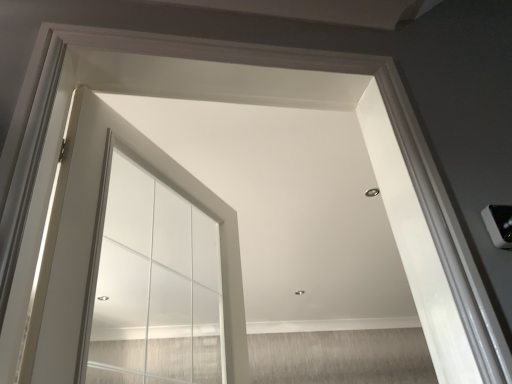
Image resolution: width=512 pixels, height=384 pixels. What do you see at coordinates (93, 224) in the screenshot?
I see `white glossy door at upper left` at bounding box center [93, 224].

Where is `white glossy door at upper left`? The height and width of the screenshot is (384, 512). white glossy door at upper left is located at coordinates (93, 224).

Locate an element on the screen. Image resolution: width=512 pixels, height=384 pixels. white glossy door at upper left is located at coordinates (93, 224).